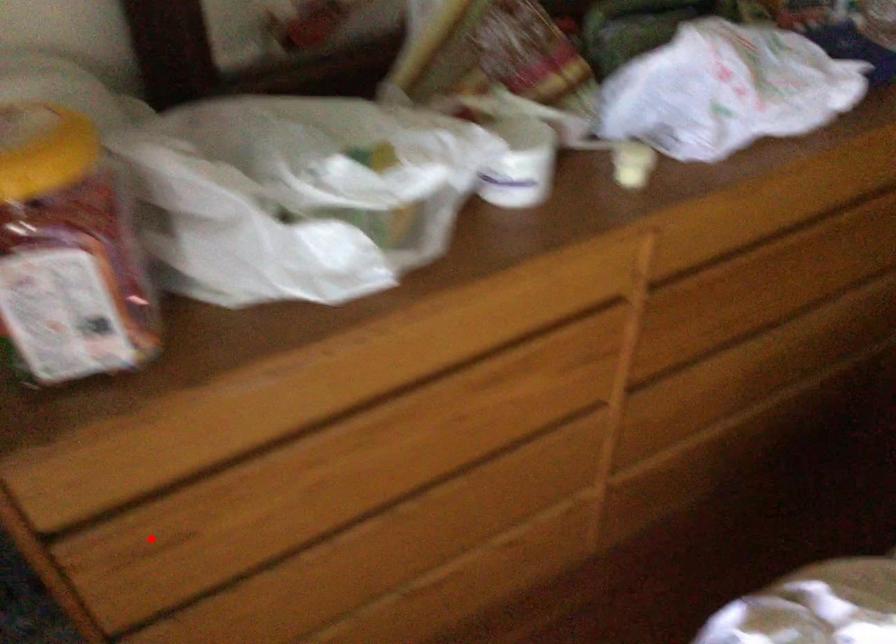
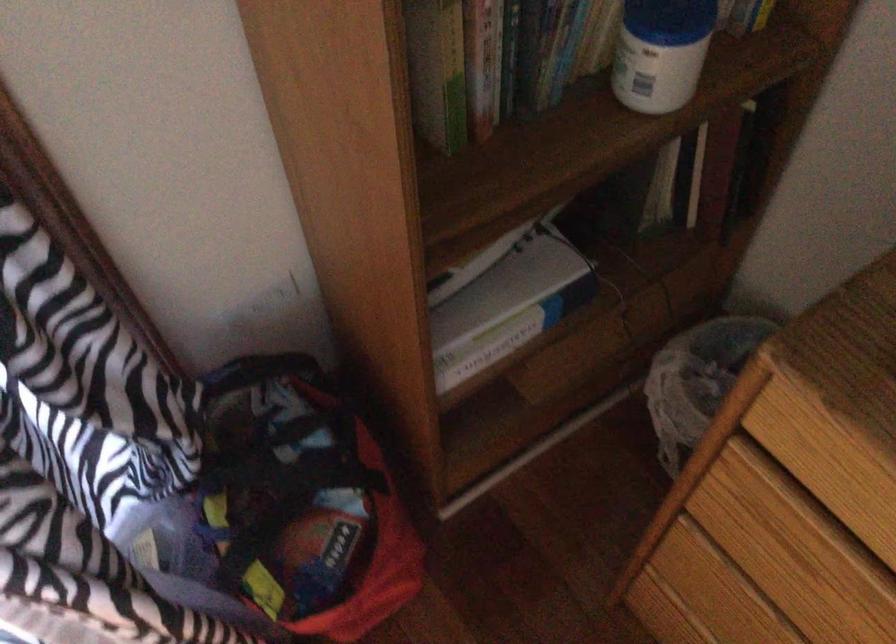
Question: I am providing you with two images of the same scene from different viewpoints. A red point is shown in image1. For the corresponding object point in image2, is it positioned nearer or farther from the camera?

Choices:
 (A) Nearer
 (B) Farther

Answer: (A)